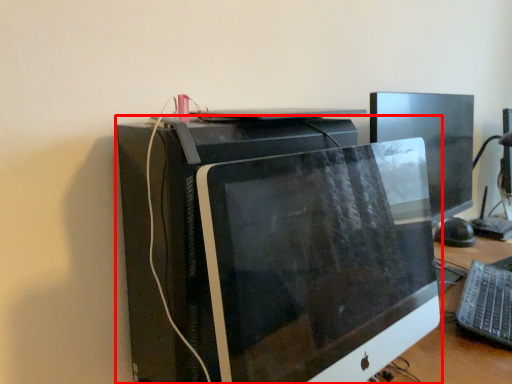
Question: Observing the image, what is the correct spatial positioning of computer monitor (annotated by the red box) in reference to computer keyboard?

Choices:
 (A) right
 (B) left

Answer: (B)